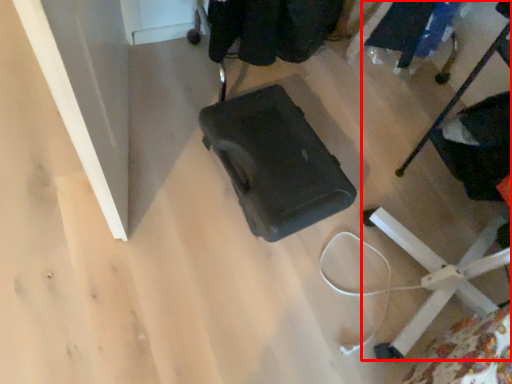
Question: Where is furniture (annotated by the red box) located in relation to baby carriage in the image?

Choices:
 (A) right
 (B) left

Answer: (A)